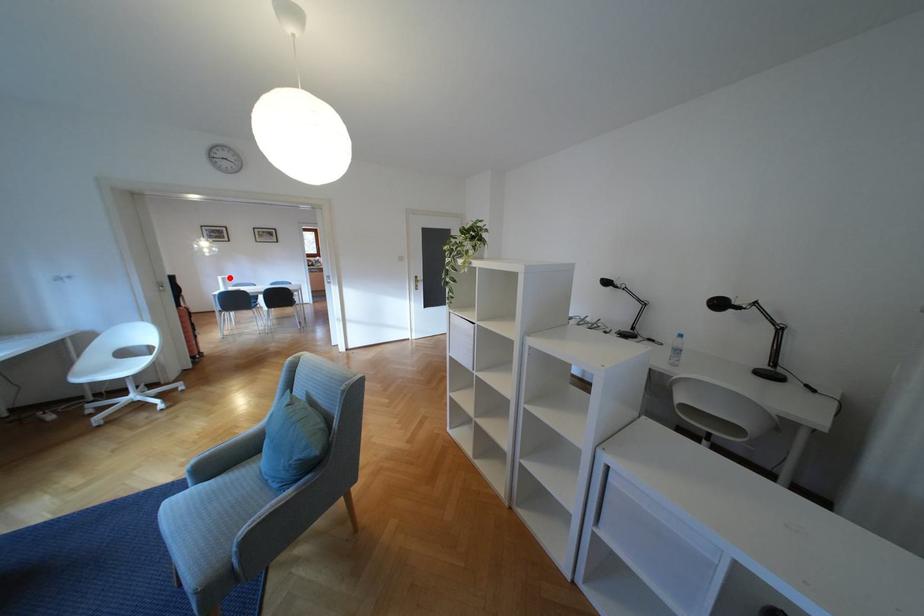
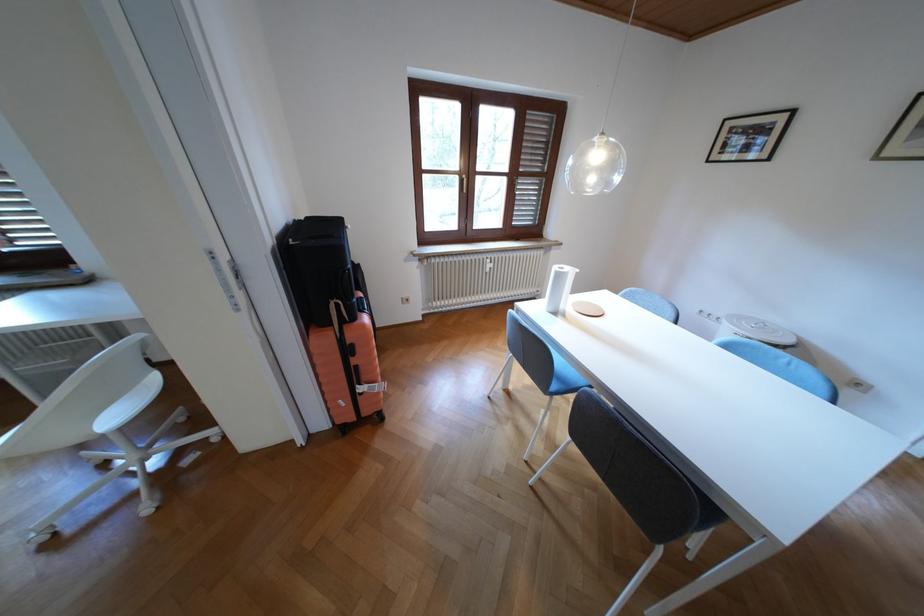
Where in the second image is the point corresponding to the highlighted location from the first image?

(565, 268)